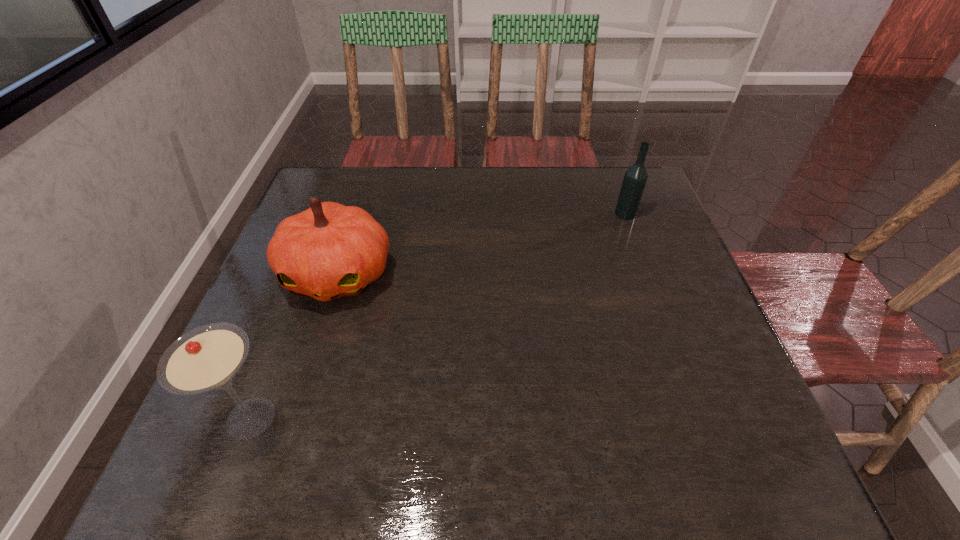
Locate an element on the screen. This screenshot has width=960, height=540. martini present at the left edge is located at coordinates (207, 358).

Find the location of a particular element. The image size is (960, 540). object that is positioned at the right edge is located at coordinates (635, 178).

Image resolution: width=960 pixels, height=540 pixels. I want to click on object that is at the near left corner, so click(x=207, y=358).

Locate an element on the screen. object that is at the far right corner is located at coordinates (635, 178).

In the image, there is a desktop. Where is `blank space at the far edge`? The height and width of the screenshot is (540, 960). blank space at the far edge is located at coordinates (480, 181).

Locate an element on the screen. free space at the near edge of the desktop is located at coordinates (546, 462).

Identify the location of vacant region at the left edge. The image size is (960, 540). click(x=329, y=301).

At what (x,y) coordinates should I click in order to perform the action: click on free space at the right edge of the desktop. Please return your answer as a coordinate pair (x, y). The height and width of the screenshot is (540, 960). Looking at the image, I should click on (732, 368).

Image resolution: width=960 pixels, height=540 pixels. In the image, there is a desktop. Identify the location of vacant space at the far left corner. (351, 192).

Image resolution: width=960 pixels, height=540 pixels. In the image, there is a desktop. Identify the location of free space at the near right corner. (766, 436).